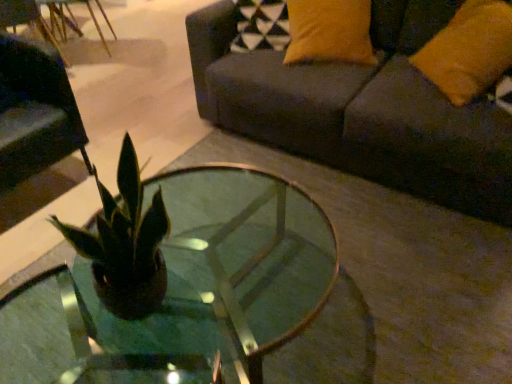
Question: Based on their positions, is matte black swivel chair at left located to the left or right of clear glass coffee table at center?

Choices:
 (A) left
 (B) right

Answer: (A)

Question: From the image's perspective, is matte black swivel chair at left located above or below clear glass coffee table at center?

Choices:
 (A) above
 (B) below

Answer: (A)

Question: Which object is the closest to the clear glass coffee table at center?

Choices:
 (A) orange fabric pillow at upper right
 (B) dark gray fabric couch at upper right
 (C) matte black swivel chair at left

Answer: (B)

Question: Which object is the farthest from the dark gray fabric couch at upper right?

Choices:
 (A) orange fabric pillow at upper right
 (B) matte black swivel chair at left
 (C) clear glass coffee table at center

Answer: (B)